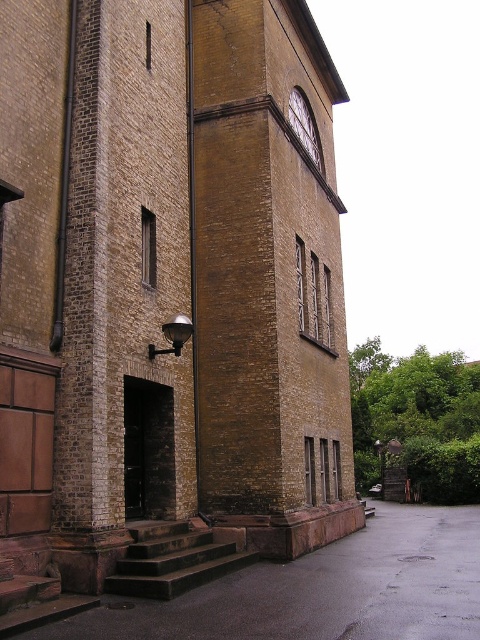
You are standing in front of the building and want to know which object is taller between the brown brick clock tower at center and the matte brown clock at upper center. Can you determine which one is taller?

The brown brick clock tower at center is taller than the matte brown clock at upper center according to the description.

You are standing in front of the building and want to enter through the doorway. Which object, the brown brick clock tower at center or the matte brown clock at upper center, is closer to your current position?

The brown brick clock tower at center is closer to your current position because it is located below the matte brown clock at upper center, meaning the tower is nearer to the ground level where you are standing.

You are standing at the entrance of the building and want to walk towards the point marked as point (228, 157). Which direction should you move relative to the other point, point (301, 102)?

Point (228, 157) is in front of point (301, 102), so you should move towards the direction of point (228, 157) which is closer to you compared to point (301, 102).